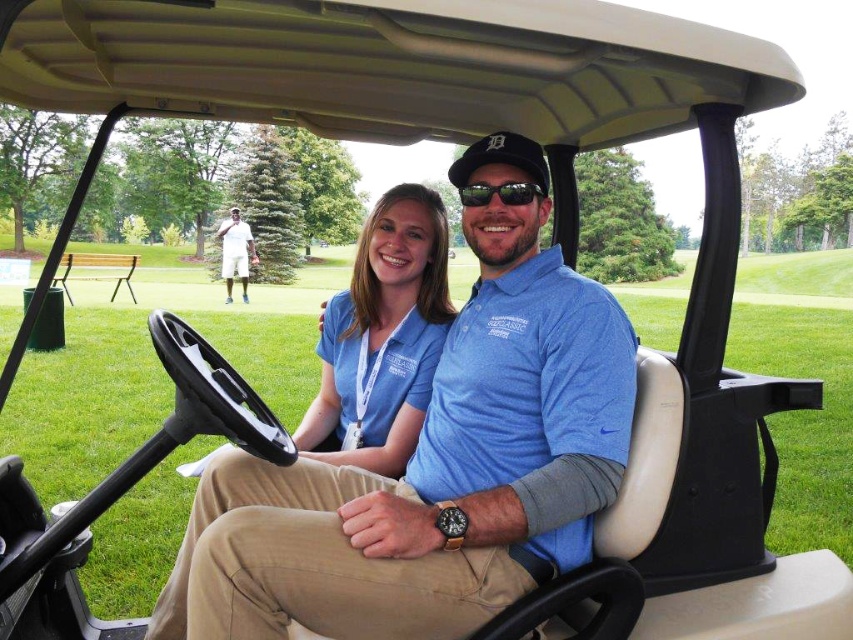
Find the location of a particular element. matte blue shirt at center is located at coordinates click(384, 336).

Can you confirm if matte blue shirt at center is thinner than white cotton shorts at upper left?

Yes, matte blue shirt at center is thinner than white cotton shorts at upper left.

Identify the location of matte blue shirt at center. (384, 336).

Image resolution: width=853 pixels, height=640 pixels. What are the coordinates of `matte blue shirt at center` in the screenshot? It's located at (384, 336).

Is blue cotton shirt at center taller than white cotton shorts at upper left?

No.

Is blue cotton shirt at center in front of white cotton shorts at upper left?

Yes, it is.

Is point (241, 532) positioned in front of point (224, 225)?

Yes, point (241, 532) is in front of point (224, 225).

The height and width of the screenshot is (640, 853). I want to click on blue cotton shirt at center, so click(x=434, y=464).

Consider the image. Does white cotton shorts at upper left have a greater width compared to black plastic sunglasses at center?

Correct, the width of white cotton shorts at upper left exceeds that of black plastic sunglasses at center.

Can you confirm if white cotton shorts at upper left is positioned below black plastic sunglasses at center?

No.

Is point (247, 228) behind point (519, 204)?

Yes, it is behind point (519, 204).

You are a GUI agent. You are given a task and a screenshot of the screen. Output one action in this format:
    pyautogui.click(x=<x>, y=<y>)
    Task: Click on the white cotton shorts at upper left
    The image size is (853, 640).
    Given the screenshot: What is the action you would take?
    pyautogui.click(x=235, y=252)